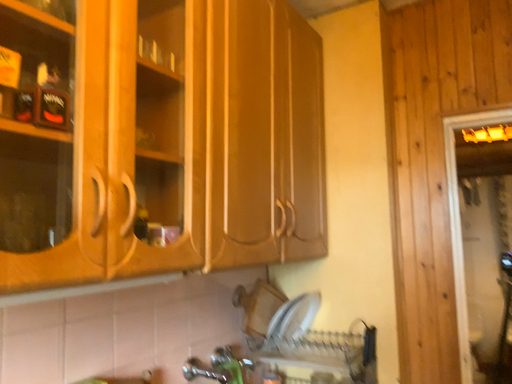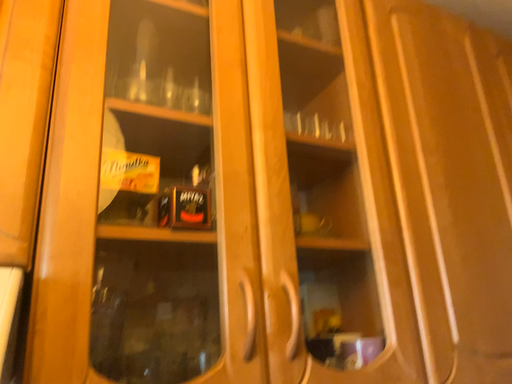
Question: Which way did the camera rotate in the video?

Choices:
 (A) rotated upward
 (B) rotated downward

Answer: (A)